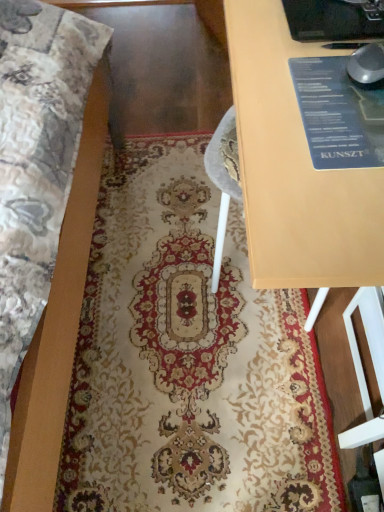
Question: In terms of height, does carpet with intricate patterns at center look taller or shorter compared to matte wood table at center?

Choices:
 (A) short
 (B) tall

Answer: (A)

Question: Do you think carpet with intricate patterns at center is within matte wood table at center, or outside of it?

Choices:
 (A) outside
 (B) inside

Answer: (A)

Question: From the image's perspective, relative to matte wood table at center, is carpet with intricate patterns at center above or below?

Choices:
 (A) above
 (B) below

Answer: (B)

Question: Does point (357, 1) appear closer or farther from the camera than point (258, 303)?

Choices:
 (A) closer
 (B) farther

Answer: (A)

Question: In terms of height, does matte wood table at center look taller or shorter compared to carpet with intricate patterns at center?

Choices:
 (A) short
 (B) tall

Answer: (B)

Question: Is matte wood table at center situated inside carpet with intricate patterns at center or outside?

Choices:
 (A) inside
 (B) outside

Answer: (B)

Question: From the image's perspective, is matte wood table at center located above or below carpet with intricate patterns at center?

Choices:
 (A) above
 (B) below

Answer: (A)